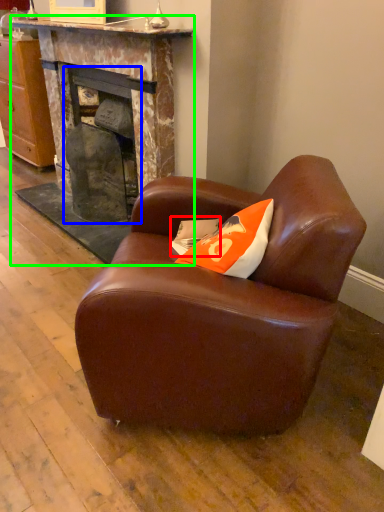
Question: Which object is positioned closest to pillow (highlighted by a red box)? Select from fireplace (highlighted by a blue box) and fireplace (highlighted by a green box).

Choices:
 (A) fireplace
 (B) fireplace

Answer: (A)